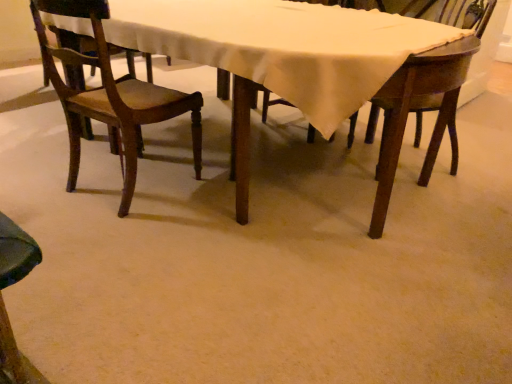
Locate an element on the screen. Image resolution: width=512 pixels, height=384 pixels. free location to the right of wooden chair at upper right, positioned as the 2th chair in left-to-right order is located at coordinates (481, 169).